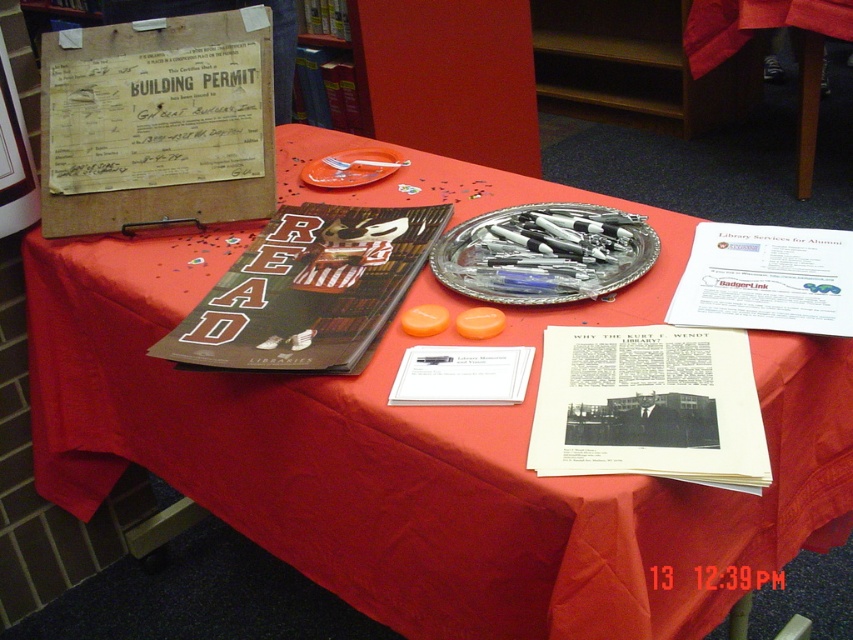
Is point (540, 284) in front of point (337, 186)?

Yes, point (540, 284) is closer to viewer.

Is point (436, 248) more distant than point (311, 176)?

No.

Which is in front, point (531, 264) or point (321, 180)?

Point (531, 264)

Locate an element on the screen. This screenshot has height=640, width=853. silver metallic tray at center is located at coordinates (544, 253).